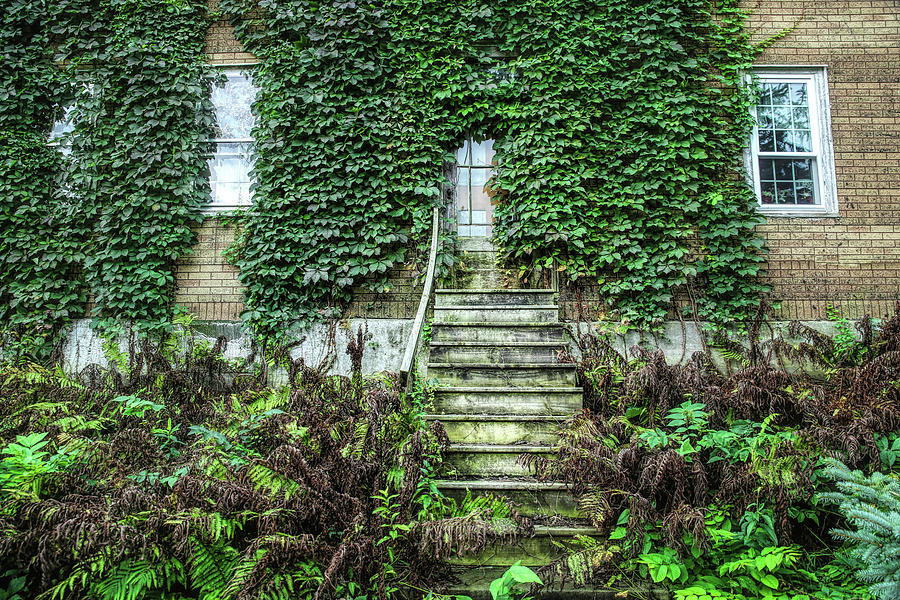
I want to click on light grey window frame, so click(x=824, y=211).